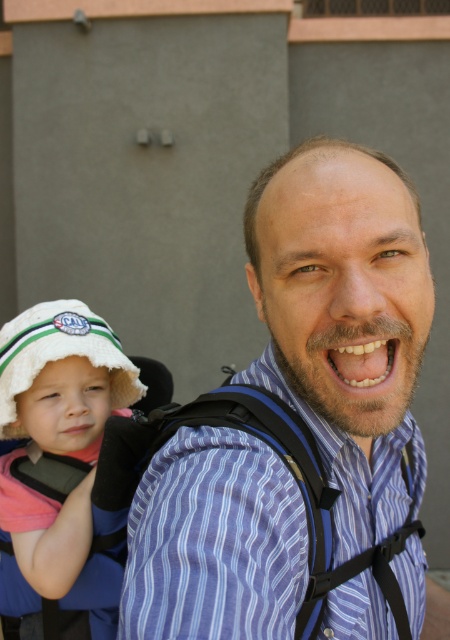
Question: Based on their relative distances, which object is nearer to the blue striped shirt at center?

Choices:
 (A) smooth blue shirt at center
 (B) white cotton hat at left

Answer: (A)

Question: Among these points, which one is nearest to the camera?

Choices:
 (A) (81, 362)
 (B) (421, 614)

Answer: (B)

Question: Which of the following is the farthest from the observer?

Choices:
 (A) smooth blue shirt at center
 (B) white cotton hat at left
 (C) blue striped shirt at center

Answer: (B)

Question: From the image, what is the correct spatial relationship of blue striped shirt at center in relation to white cotton hat at left?

Choices:
 (A) above
 (B) below

Answer: (B)

Question: Can you confirm if blue striped shirt at center is positioned to the left of white cotton hat at left?

Choices:
 (A) yes
 (B) no

Answer: (B)

Question: Is blue striped shirt at center thinner than smooth blue shirt at center?

Choices:
 (A) no
 (B) yes

Answer: (A)